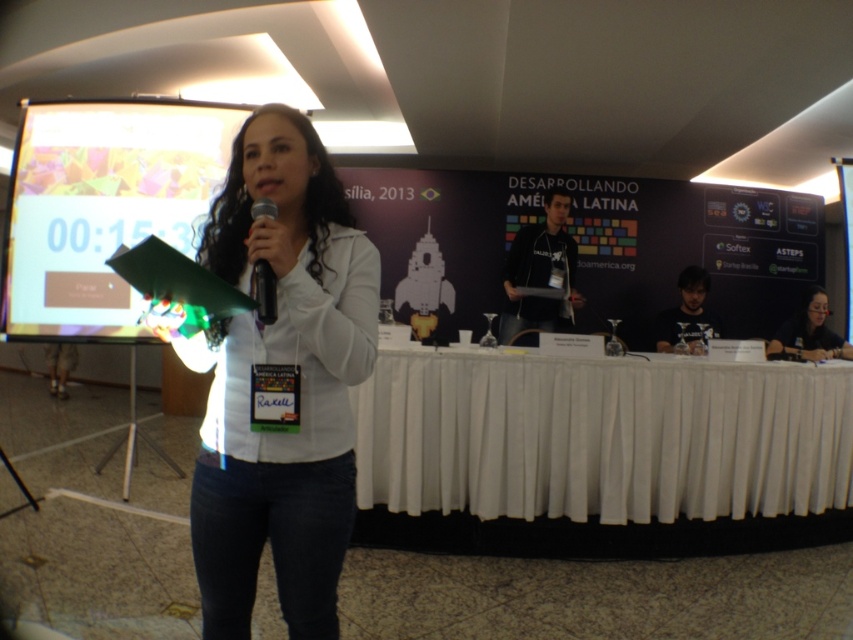
Between matte green book at upper left and matte black laptop at lower right, which one is positioned higher?

matte green book at upper left is above.

Which is behind, point (142, 125) or point (799, 340)?

The point (799, 340) is more distant.

Find the location of `matte green book at upper left`. matte green book at upper left is located at coordinates (102, 208).

Does white matte jacket at center have a smaller size compared to matte black laptop at lower right?

Yes.

Which is in front, point (248, 394) or point (773, 336)?

Positioned in front is point (248, 394).

Which is behind, point (212, 467) or point (833, 339)?

The point (833, 339) is behind.

The width and height of the screenshot is (853, 640). What are the coordinates of `white matte jacket at center` in the screenshot? It's located at (282, 384).

Who is positioned more to the right, white cloth at center or black plastic microphone at center?

From the viewer's perspective, white cloth at center appears more on the right side.

The width and height of the screenshot is (853, 640). I want to click on white cloth at center, so click(x=601, y=454).

Find the location of a particular element. white cloth at center is located at coordinates (601, 454).